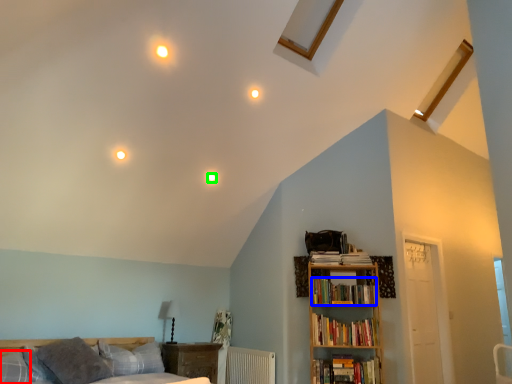
Question: Which object is positioned closest to pillow (highlighted by a red box)? Select from book (highlighted by a blue box) and lighting (highlighted by a green box).

Choices:
 (A) book
 (B) lighting

Answer: (B)